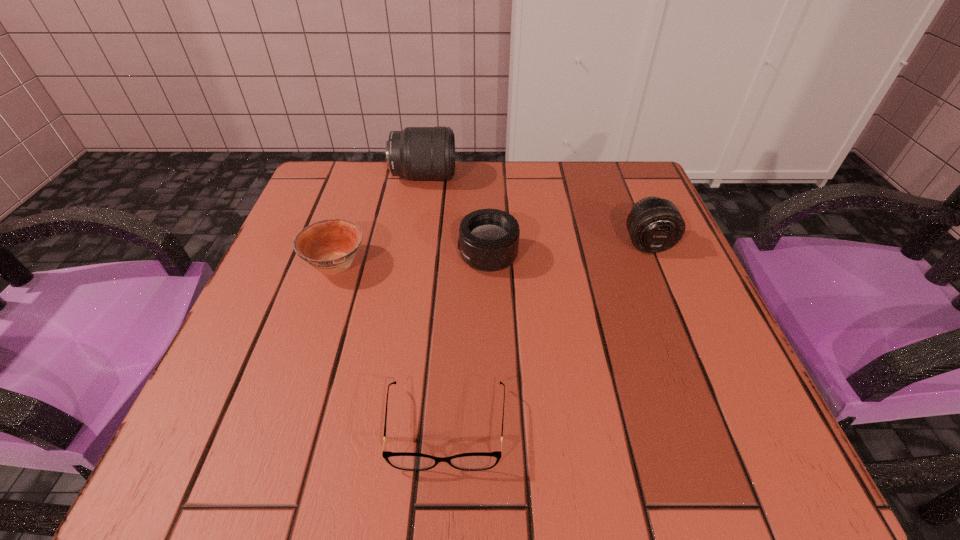
The width and height of the screenshot is (960, 540). I want to click on free area in between the spectacles and the bowl, so click(x=391, y=346).

Where is `object that is the closest to the shortest telephoto lens`? This screenshot has height=540, width=960. object that is the closest to the shortest telephoto lens is located at coordinates (418, 153).

This screenshot has height=540, width=960. In order to click on the third closest object relative to the rightmost telephoto lens in this screenshot , I will do `click(477, 461)`.

Locate an element on the screen. The height and width of the screenshot is (540, 960). the second closest telephoto lens relative to the nearest object is located at coordinates (654, 224).

In order to click on telephoto lens that is the second nearest to the second telephoto lens from left to right in this screenshot , I will do `click(654, 224)`.

You are a GUI agent. You are given a task and a screenshot of the screen. Output one action in this format:
    pyautogui.click(x=<x>, y=<y>)
    Task: Click on the free location that satisfies the following two spatial constraints: 1. on the side of the second telephoto lens from left to right with brand markings and control switches; 2. on the front-facing side of the spectacles
    Image resolution: width=960 pixels, height=540 pixels.
    Given the screenshot: What is the action you would take?
    pyautogui.click(x=492, y=427)

This screenshot has height=540, width=960. What are the coordinates of `free space that satisfies the following two spatial constraints: 1. on the side of the second telephoto lens from right to left with brand markings and control switches; 2. on the front-facing side of the nearest object` in the screenshot? It's located at (492, 427).